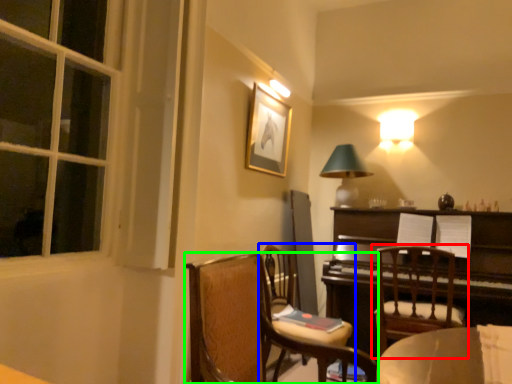
Question: Based on their relative distances, which object is nearer to chair (highlighted by a red box)? Choose from chair (highlighted by a blue box) and chair (highlighted by a green box).

Choices:
 (A) chair
 (B) chair

Answer: (A)